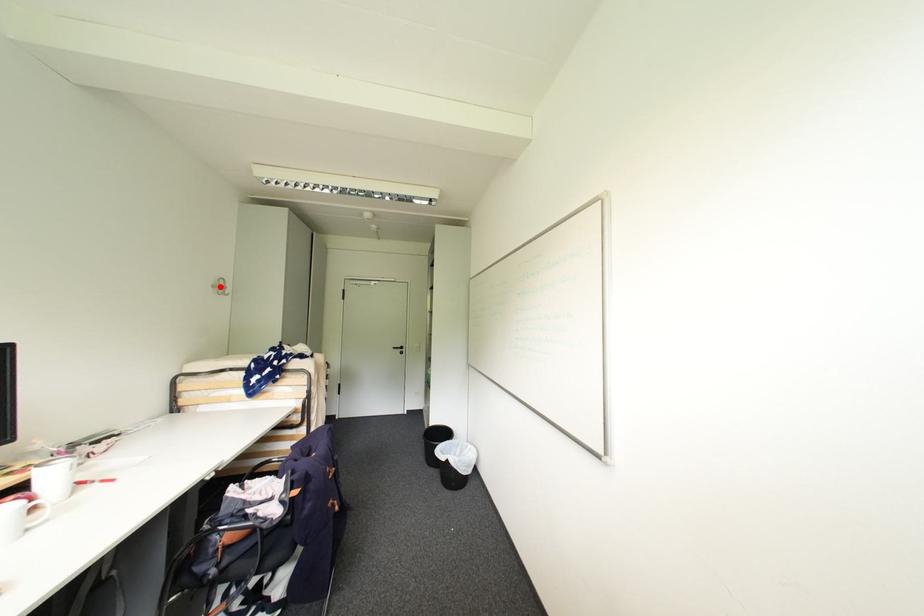
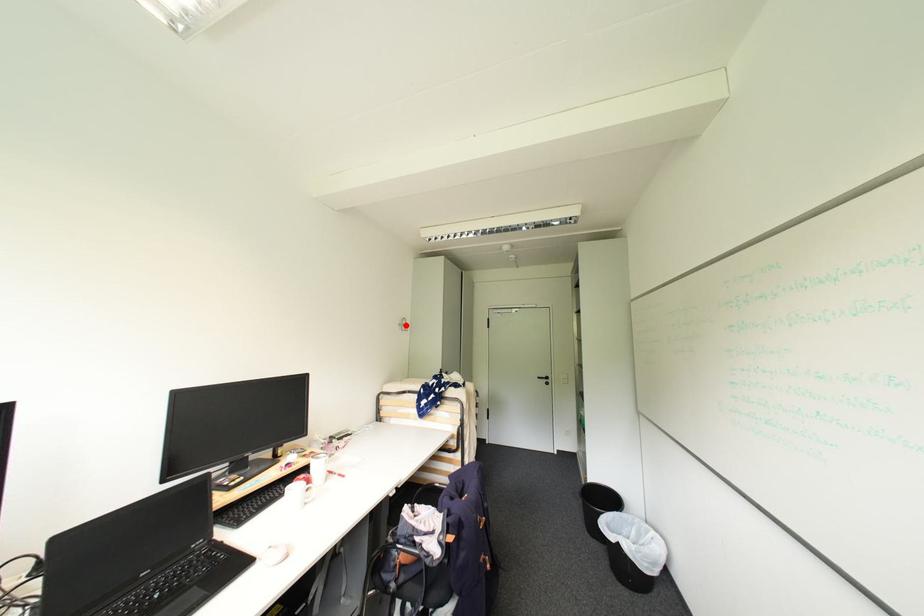
I am providing you with two images of the same scene from different viewpoints. A red point is marked on the first image and another point is marked on the second image. Are the points marked in image1 and image2 representing the same 3D position?

Yes